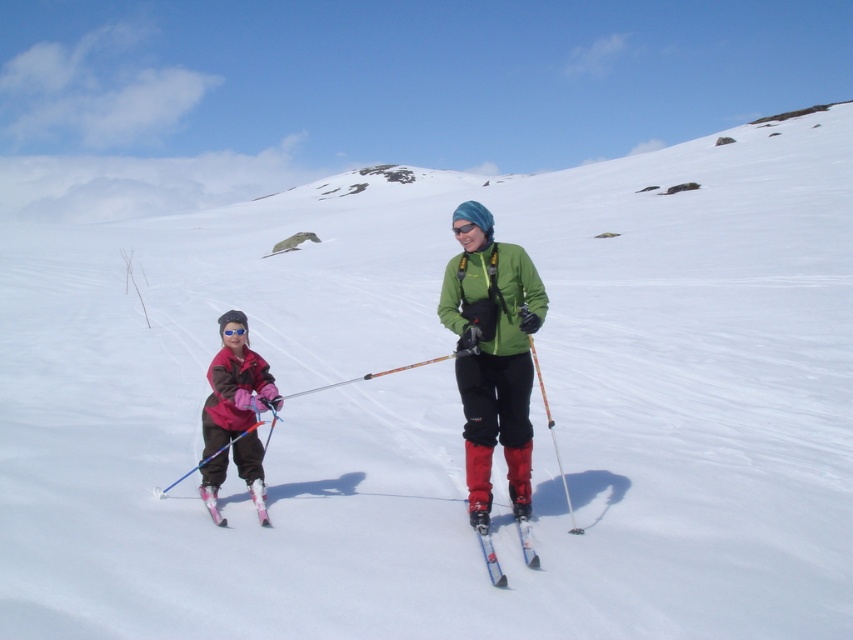
Question: Which object is the closest to the metallic blue skis at center?

Choices:
 (A) matte pink ski suit at left
 (B) green matte jacket at center
 (C) pink glossy ski at lower left

Answer: (B)

Question: Estimate the real-world distances between objects in this image. Which object is closer to the metallic blue skis at center?

Choices:
 (A) green matte jacket at center
 (B) matte pink ski suit at left
 (C) pink glossy ski at lower left

Answer: (A)

Question: Is green matte jacket at center positioned in front of pink glossy ski at lower left?

Choices:
 (A) no
 (B) yes

Answer: (B)

Question: Does matte pink ski suit at left appear over metallic blue skis at center?

Choices:
 (A) no
 (B) yes

Answer: (B)

Question: Which point is closer to the camera taking this photo?

Choices:
 (A) (486, 513)
 (B) (213, 515)
 (C) (491, 572)

Answer: (C)

Question: Can you confirm if metallic blue skis at center is positioned below pink glossy ski at lower left?

Choices:
 (A) no
 (B) yes

Answer: (B)